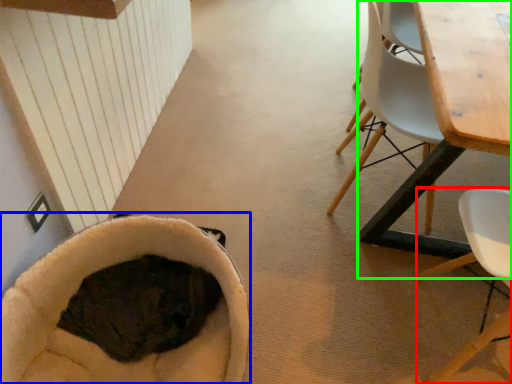
Question: Based on their relative distances, which object is farther from chair (highlighted by a red box)? Choose from bean bag chair (highlighted by a blue box) and table (highlighted by a green box).

Choices:
 (A) bean bag chair
 (B) table

Answer: (A)